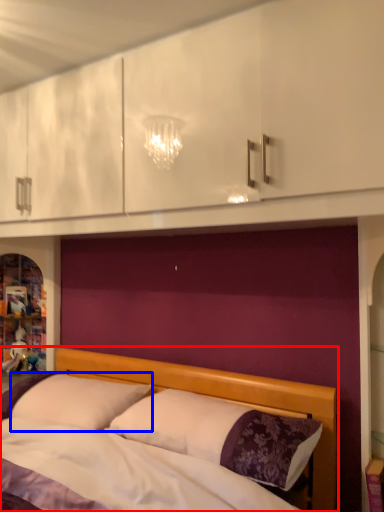
Question: Which of the following is the closest to the observer, bed (highlighted by a red box) or pillow (highlighted by a blue box)?

Choices:
 (A) bed
 (B) pillow

Answer: (A)